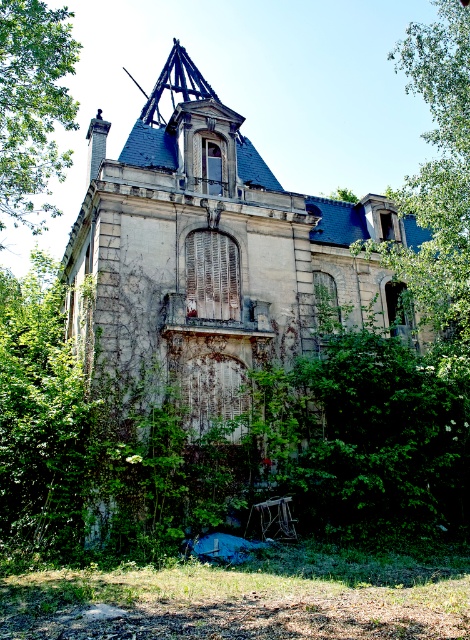
Question: Is weathered stone mansion at center smaller than green leafy tree at upper left?

Choices:
 (A) yes
 (B) no

Answer: (B)

Question: Which point is farther to the camera?

Choices:
 (A) (438, 275)
 (B) (64, 164)
 (C) (195, 394)

Answer: (B)

Question: Which of the following is the farthest from the observer?

Choices:
 (A) (432, 320)
 (B) (368, 237)
 (C) (24, 49)

Answer: (B)

Question: Is weathered stone mansion at center thinner than green leafy tree at upper right?

Choices:
 (A) yes
 (B) no

Answer: (B)

Question: Does green leafy tree at upper right come behind green leafy tree at upper left?

Choices:
 (A) no
 (B) yes

Answer: (A)

Question: Which point appears farthest from the camera in this image?

Choices:
 (A) (232, 328)
 (B) (446, 321)
 (C) (7, 140)

Answer: (C)